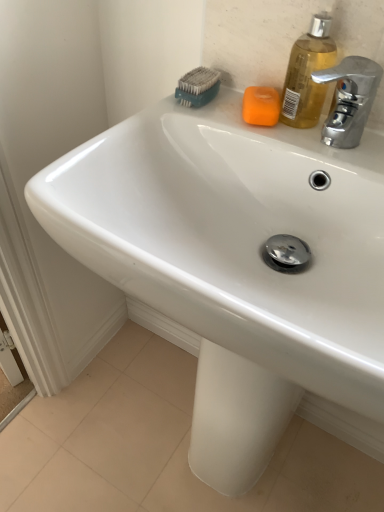
Question: Does point (319, 25) appear closer or farther from the camera than point (216, 91)?

Choices:
 (A) farther
 (B) closer

Answer: (B)

Question: From the image's perspective, is translucent yellow liquid at upper right above or below teal plastic brush at upper center?

Choices:
 (A) above
 (B) below

Answer: (B)

Question: Estimate the real-world distances between objects in this image. Which object is farther from the orange matte soap at upper center?

Choices:
 (A) teal plastic brush at upper center
 (B) translucent yellow liquid at upper right

Answer: (A)

Question: Which of these objects is positioned closest to the translucent yellow liquid at upper right?

Choices:
 (A) orange matte soap at upper center
 (B) teal plastic brush at upper center

Answer: (A)